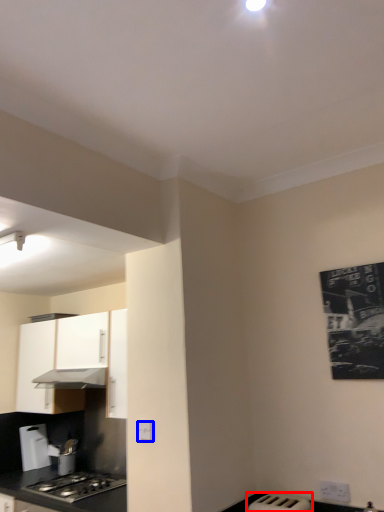
Question: Which of the following is the farthest to the observer, appliance (highlighted by a red box) or electric outlet (highlighted by a blue box)?

Choices:
 (A) appliance
 (B) electric outlet

Answer: (B)